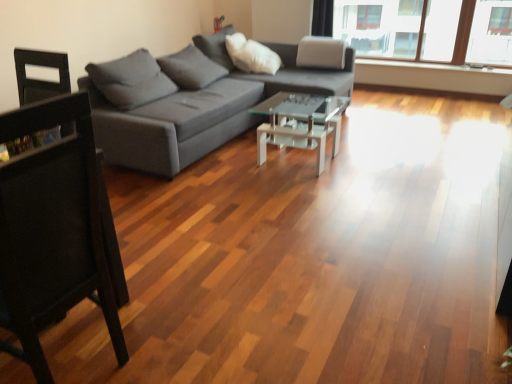
The width and height of the screenshot is (512, 384). Describe the element at coordinates (191, 102) in the screenshot. I see `gray fabric couch at center` at that location.

Find the location of a particular element. The image size is (512, 384). gray fabric couch at center is located at coordinates (191, 102).

You are a GUI agent. You are given a task and a screenshot of the screen. Output one action in this format:
    pyautogui.click(x=<x>, y=<y>)
    Task: Click on the black wood chair at left
    
    Given the screenshot: What is the action you would take?
    pyautogui.click(x=51, y=230)

Which object is positioned more to the right, black wood chair at left or transparent glass coffee table at center?

From the viewer's perspective, transparent glass coffee table at center appears more on the right side.

The image size is (512, 384). Find the location of `chair positioned vertically above the transparent glass coffee table at center (from a real-world perspective)`. chair positioned vertically above the transparent glass coffee table at center (from a real-world perspective) is located at coordinates (51, 230).

Is black wood chair at left turned away from transparent glass coffee table at center?

black wood chair at left does not have its back to transparent glass coffee table at center.

Who is more distant, black wood chair at left or transparent glass coffee table at center?

transparent glass coffee table at center.

Is transparent glass coffee table at center far from black wood chair at left?

Yes, transparent glass coffee table at center and black wood chair at left are quite far apart.

Is transparent glass coffee table at center aimed at black wood chair at left?

No, transparent glass coffee table at center does not turn towards black wood chair at left.

Which point is more distant from viewer, (x=330, y=122) or (x=28, y=294)?

The point (x=330, y=122) is behind.

Is transparent glass coffee table at center taller or shorter than black wood chair at left?

In the image, transparent glass coffee table at center appears to be shorter than black wood chair at left.

Is gray fabric couch at center oriented towards transparent glass coffee table at center?

Yes, gray fabric couch at center faces towards transparent glass coffee table at center.

Can you tell me how much gray fabric couch at center and transparent glass coffee table at center differ in facing direction?

The angular difference between gray fabric couch at center and transparent glass coffee table at center is 0.000264 degrees.

Considering the sizes of objects gray fabric couch at center and transparent glass coffee table at center in the image provided, who is taller, gray fabric couch at center or transparent glass coffee table at center?

With more height is gray fabric couch at center.

Between gray fabric couch at center and transparent glass coffee table at center, which one has larger width?

With larger width is gray fabric couch at center.

Is point (298, 112) positioned before point (345, 58)?

Yes, point (298, 112) is in front of point (345, 58).

Is transparent glass coffee table at center beside gray fabric couch at center?

They are not placed beside each other.

Is transparent glass coffee table at center positioned beyond the bounds of gray fabric couch at center?

Actually, transparent glass coffee table at center is within gray fabric couch at center.

Is transparent glass coffee table at center in front of or behind gray fabric couch at center in the image?

Clearly, transparent glass coffee table at center is behind gray fabric couch at center.

Between gray fabric couch at center and black wood chair at left, which one has larger width?

gray fabric couch at center.

From a real-world perspective, between gray fabric couch at center and black wood chair at left, who is vertically lower?

From a 3D spatial view, gray fabric couch at center is below.

Which point is more distant from viewer, (x=130, y=101) or (x=71, y=167)?

The point (x=130, y=101) is more distant.

From a real-world perspective, is black wood chair at left positioned over gray fabric couch at center based on gravity?

Yes, from a real-world perspective, black wood chair at left is on top of gray fabric couch at center.

Can you tell me how much black wood chair at left and gray fabric couch at center differ in facing direction?

They differ by 175 degrees in their facing directions.

How far apart are black wood chair at left and gray fabric couch at center?

black wood chair at left is 6.85 feet from gray fabric couch at center.

Does black wood chair at left lie in front of gray fabric couch at center?

Yes, black wood chair at left is closer to the viewer.

The image size is (512, 384). What are the coordinates of `coffee table that appears behind the black wood chair at left` in the screenshot? It's located at (300, 123).

Identify the location of chair on the left side of transparent glass coffee table at center. This screenshot has width=512, height=384. (51, 230).

Which object lies further to the anchor point black wood chair at left, gray fabric couch at center or transparent glass coffee table at center?

The object further to black wood chair at left is transparent glass coffee table at center.

From the image, which object appears to be farther from transparent glass coffee table at center, black wood chair at left or gray fabric couch at center?

black wood chair at left.

Looking at the image, which one is located closer to gray fabric couch at center, black wood chair at left or transparent glass coffee table at center?

transparent glass coffee table at center is closer to gray fabric couch at center.

From the image, which object appears to be farther from gray fabric couch at center, transparent glass coffee table at center or black wood chair at left?

black wood chair at left.

Based on their spatial positions, is transparent glass coffee table at center or gray fabric couch at center further from black wood chair at left?

Among the two, transparent glass coffee table at center is located further to black wood chair at left.

From the image, which object appears to be nearer to transparent glass coffee table at center, gray fabric couch at center or black wood chair at left?

gray fabric couch at center is closer to transparent glass coffee table at center.

Find the location of `studio couch located between black wood chair at left and transparent glass coffee table at center in the depth direction`. studio couch located between black wood chair at left and transparent glass coffee table at center in the depth direction is located at coordinates (191, 102).